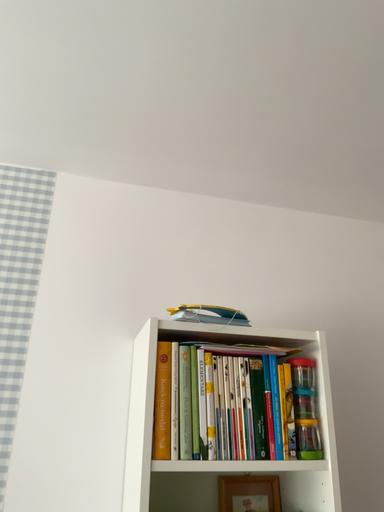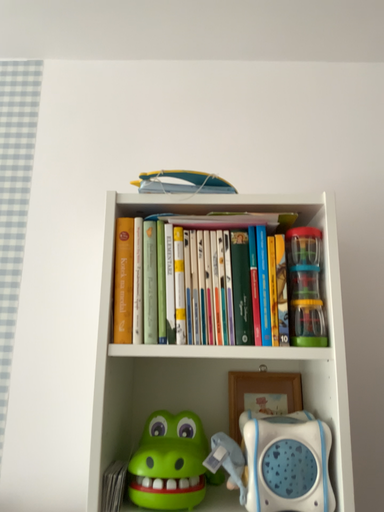
Question: How did the camera likely rotate when shooting the video?

Choices:
 (A) rotated left
 (B) rotated right

Answer: (A)